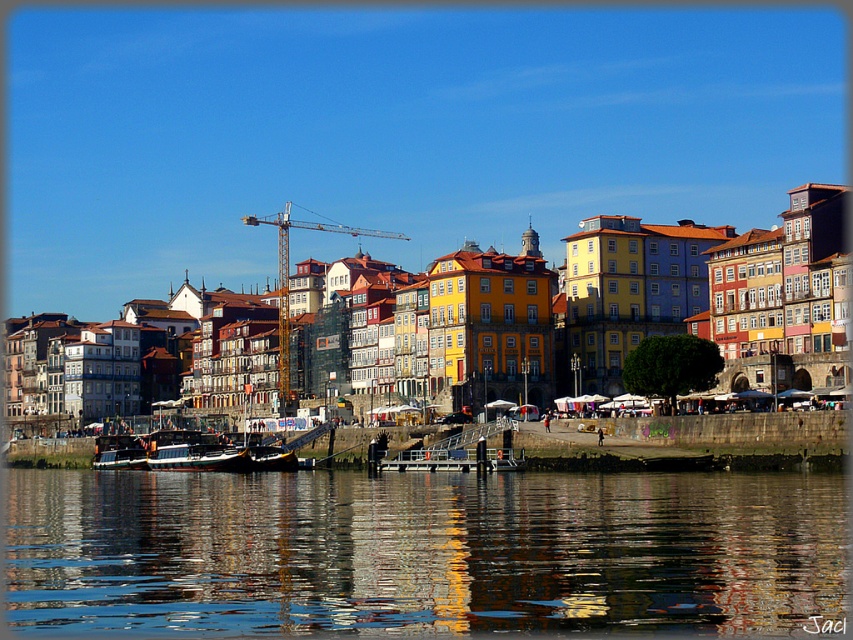
Question: Can you confirm if reflective glass water at lower center is thinner than wooden boat at left?

Choices:
 (A) no
 (B) yes

Answer: (A)

Question: Can you confirm if reflective glass water at lower center is positioned below wooden boat at left?

Choices:
 (A) no
 (B) yes

Answer: (A)

Question: Is reflective glass water at lower center below wooden boat at left?

Choices:
 (A) no
 (B) yes

Answer: (A)

Question: Which point is closer to the camera?

Choices:
 (A) wooden boat at left
 (B) reflective glass water at lower center

Answer: (B)